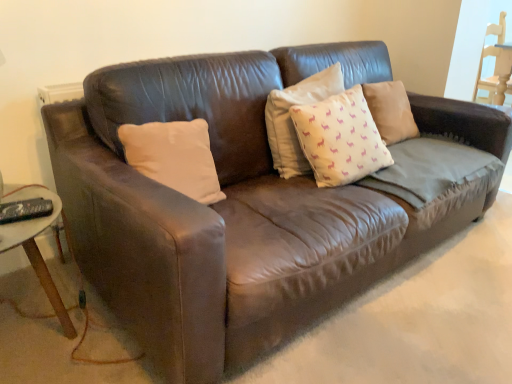
This screenshot has height=384, width=512. What do you see at coordinates (174, 156) in the screenshot? I see `white soft cushion at left` at bounding box center [174, 156].

The height and width of the screenshot is (384, 512). I want to click on white soft cushion at left, so click(174, 156).

Where is `white soft cushion at left`? The height and width of the screenshot is (384, 512). white soft cushion at left is located at coordinates (174, 156).